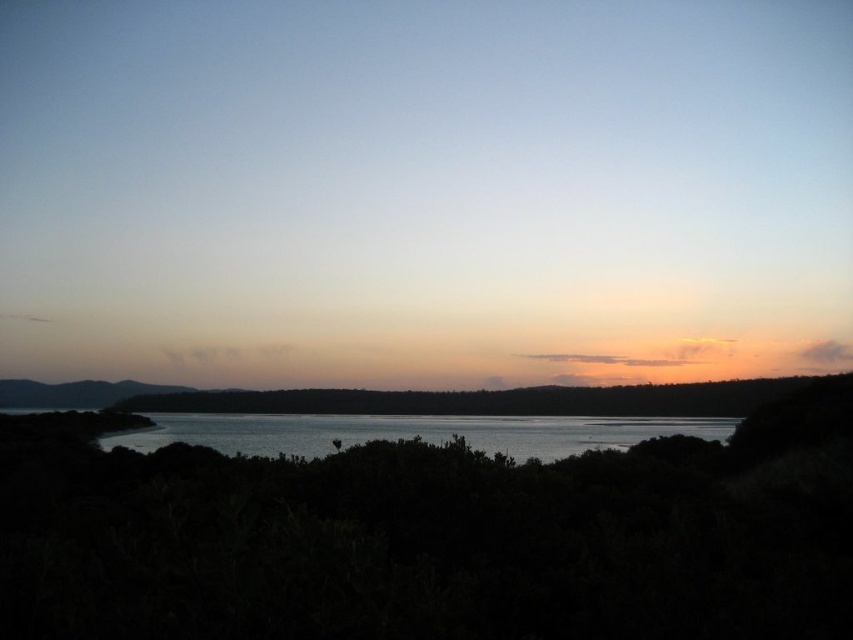
Question: Is the position of glistening silver water at center more distant than that of matte orange sky at center?

Choices:
 (A) no
 (B) yes

Answer: (A)

Question: Which of the following is the closest to the observer?

Choices:
 (A) matte orange sky at center
 (B) glistening silver water at center

Answer: (B)

Question: Can you confirm if glistening silver water at center is positioned below matte orange sky at center?

Choices:
 (A) no
 (B) yes

Answer: (B)

Question: Does glistening silver water at center have a lesser width compared to matte orange sky at center?

Choices:
 (A) yes
 (B) no

Answer: (A)

Question: Which of the following is the closest to the observer?

Choices:
 (A) (672, 426)
 (B) (679, 416)

Answer: (A)

Question: Which point is closer to the camera?

Choices:
 (A) glistening silver water at center
 (B) matte orange sky at center

Answer: (A)